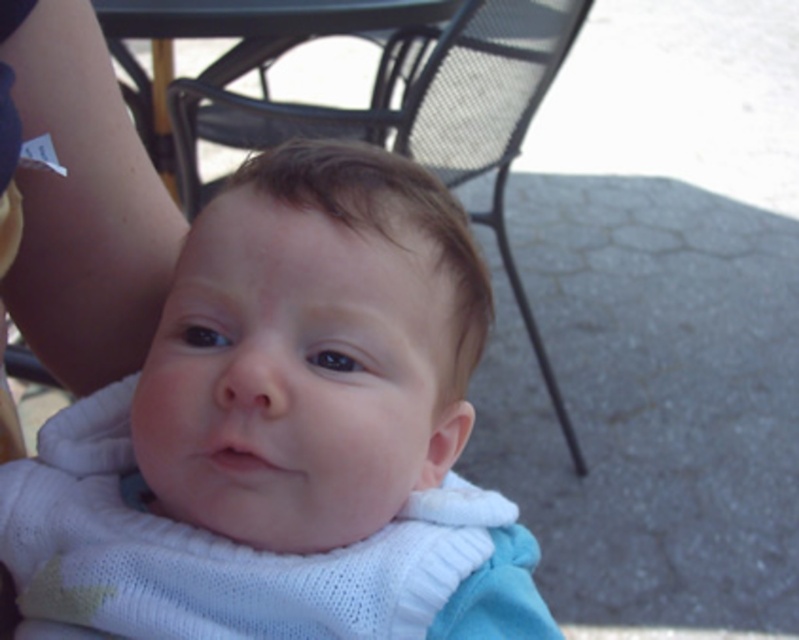
Question: Which point is closer to the camera?

Choices:
 (A) black mesh chair at upper center
 (B) white knitted baby at center

Answer: (B)

Question: Does white knitted baby at center have a larger size compared to black mesh chair at upper center?

Choices:
 (A) no
 (B) yes

Answer: (A)

Question: Is black mesh chair at upper center to the left of black metal table at upper center from the viewer's perspective?

Choices:
 (A) no
 (B) yes

Answer: (A)

Question: Is skinny white arm at upper left further to the viewer compared to black metal table at upper center?

Choices:
 (A) no
 (B) yes

Answer: (A)

Question: Among these points, which one is farthest from the camera?

Choices:
 (A) (30, 248)
 (B) (438, 259)
 (C) (499, 216)
 (D) (193, 16)

Answer: (C)

Question: Which point is farther to the camera?

Choices:
 (A) black mesh chair at upper center
 (B) white knitted baby at center
 (C) skinny white arm at upper left

Answer: (A)